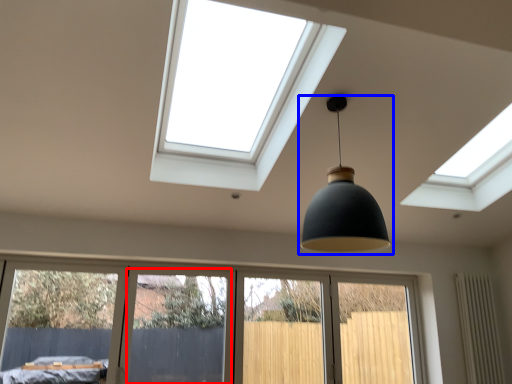
Question: Which of the following is the farthest to the observer, screen door (highlighted by a red box) or lamp (highlighted by a blue box)?

Choices:
 (A) screen door
 (B) lamp

Answer: (A)